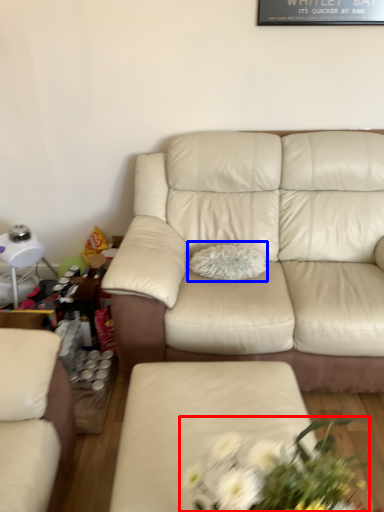
Question: Which of the following is the farthest to the observer, floral arrangement (highlighted by a red box) or pillow (highlighted by a blue box)?

Choices:
 (A) floral arrangement
 (B) pillow

Answer: (B)